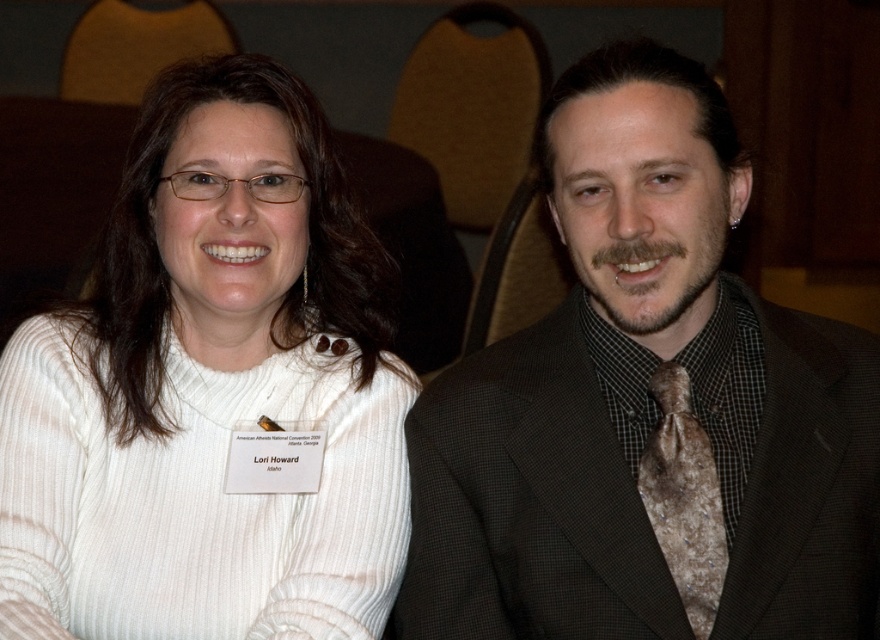
You are standing in front of a photo of two people seated in a conference room. You need to determine if you can reach the white ribbed sweater at left without moving closer. Your outstretched hand can reach 1 meter. Can you reach it?

The white ribbed sweater at left is 1.04 meters away from the viewer. Since your outstretched hand can reach 1 meter, you cannot reach the white ribbed sweater at left as it is slightly farther than your reach.

You are standing in a conference room and see the brown textured suit at center. If you were to walk directly towards it from your current position, which direction would you need to move in relation to the rows of seating?

Since the brown textured suit at center is located at point (649, 408), you would need to move towards the center area of the conference room, likely between the rows of seating to reach it.